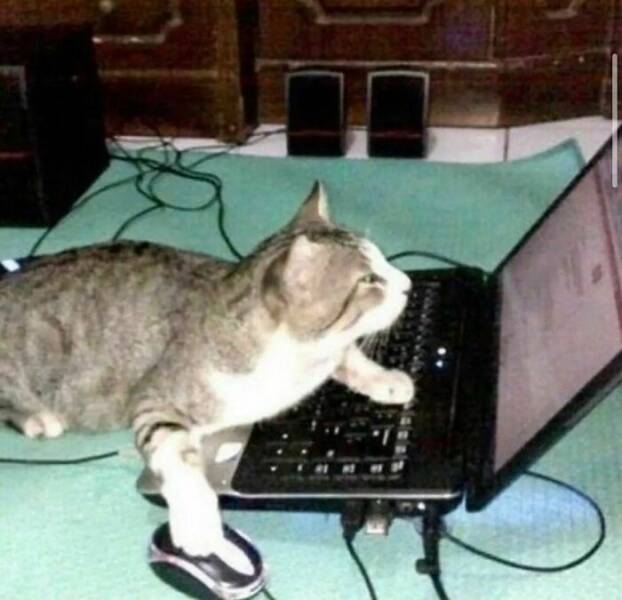
Find the location of `mouse`. mouse is located at coordinates (210, 571).